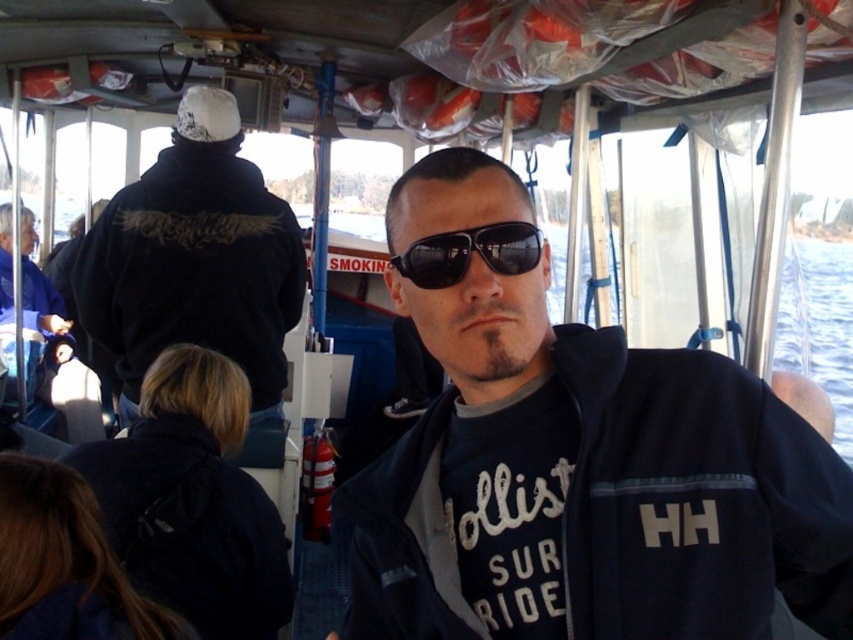
Question: Which object appears farthest from the camera in this image?

Choices:
 (A) navy blue jacket at center
 (B) black fleece jacket at upper left
 (C) black reflective sunglasses at center

Answer: (B)

Question: Can you confirm if navy blue jacket at center is wider than black fleece jacket at upper left?

Choices:
 (A) no
 (B) yes

Answer: (A)

Question: Is navy blue jacket at center positioned behind black reflective sunglasses at center?

Choices:
 (A) yes
 (B) no

Answer: (B)

Question: Which of the following is the farthest from the observer?

Choices:
 (A) (233, 122)
 (B) (517, 244)

Answer: (A)

Question: Which point is farther from the camera taking this photo?

Choices:
 (A) (479, 232)
 (B) (450, 317)
 (C) (234, 154)

Answer: (C)

Question: Observing the image, what is the correct spatial positioning of navy blue jacket at center in reference to black reflective sunglasses at center?

Choices:
 (A) right
 (B) left

Answer: (A)